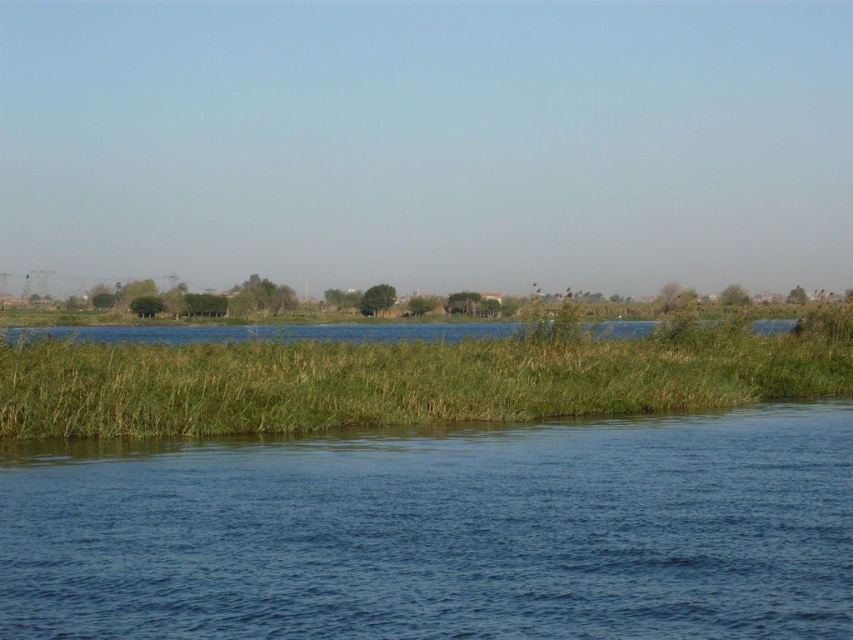
You are standing at the edge of the water in the serene landscape. There are two points marked in the image, point (184, 445) and point (645, 326). Which point is nearer to your current position?

Point (184, 445) is closer to the camera than point (645, 326), so the point (184, 445) is nearer to your current position.

You are standing on the green grassy at lower center and want to reach the blue liquid water at center. Which direction should you move to get there?

You should move downward towards the blue liquid water at center since it is located below the green grassy at lower center.